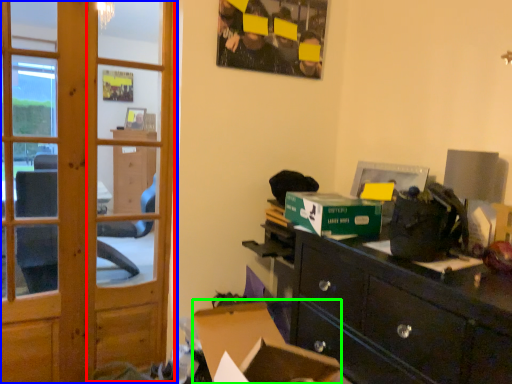
Question: Based on their relative distances, which object is nearer to screen door (highlighted by a red box)? Choose from door (highlighted by a blue box) and computer desk (highlighted by a green box).

Choices:
 (A) door
 (B) computer desk

Answer: (A)